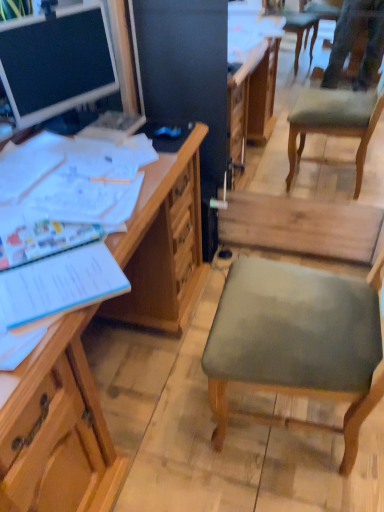
Locate an element on the screen. The width and height of the screenshot is (384, 512). free location above wooden desk at left, which appears as the first desk when ordered from the bottom (from a real-world perspective) is located at coordinates (74, 184).